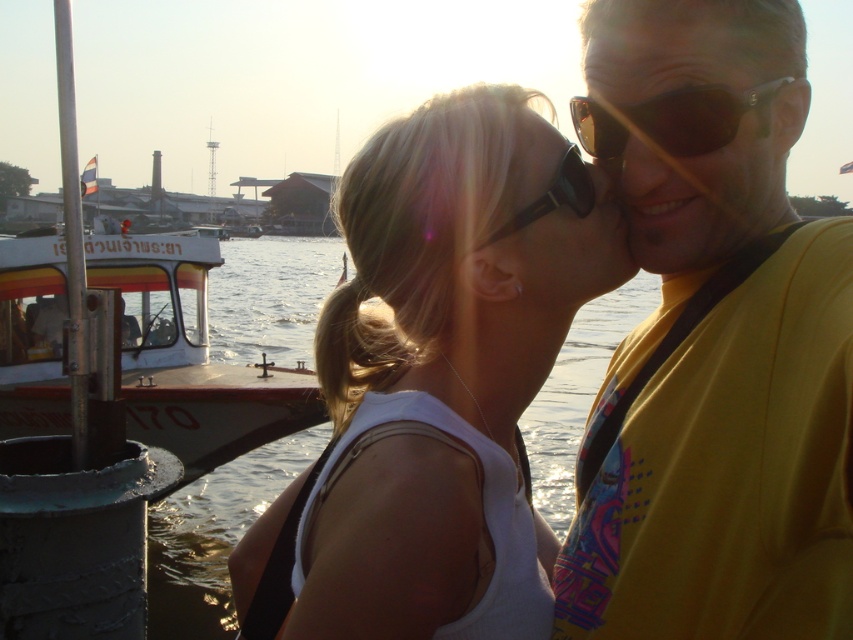
You are a photographer standing 5 feet away from a yellow fabric shirt at center. Can you take a clear photo of it without moving closer?

The yellow fabric shirt at center is 4.83 feet away from the camera, which is within the 5 feet distance. Therefore, you can take a clear photo of it without moving closer.

You are a photographer trying to capture a closeup of the matte skin forehead at upper center and the black plastic sunglasses at center. Which object should you focus on first to ensure both are in focus?

The matte skin forehead at upper center is closer to the viewer than the black plastic sunglasses at center, so you should focus on the matte skin forehead at upper center first to ensure both are in focus.

You are a photographer trying to capture a closeup shot of the matte skin forehead at upper center and the black plastic sunglasses at center. Which object should you focus on first if you want to ensure both are in focus?

The matte skin forehead at upper center is above the black plastic sunglasses at center, so you should focus on the matte skin forehead at upper center first to ensure both are in focus.